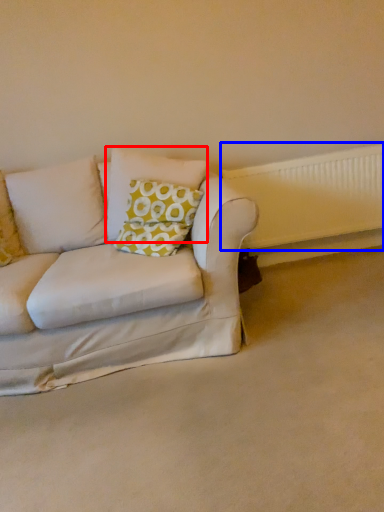
Question: Which of the following is the farthest to the observer, pillow (highlighted by a red box) or radiator (highlighted by a blue box)?

Choices:
 (A) pillow
 (B) radiator

Answer: (B)